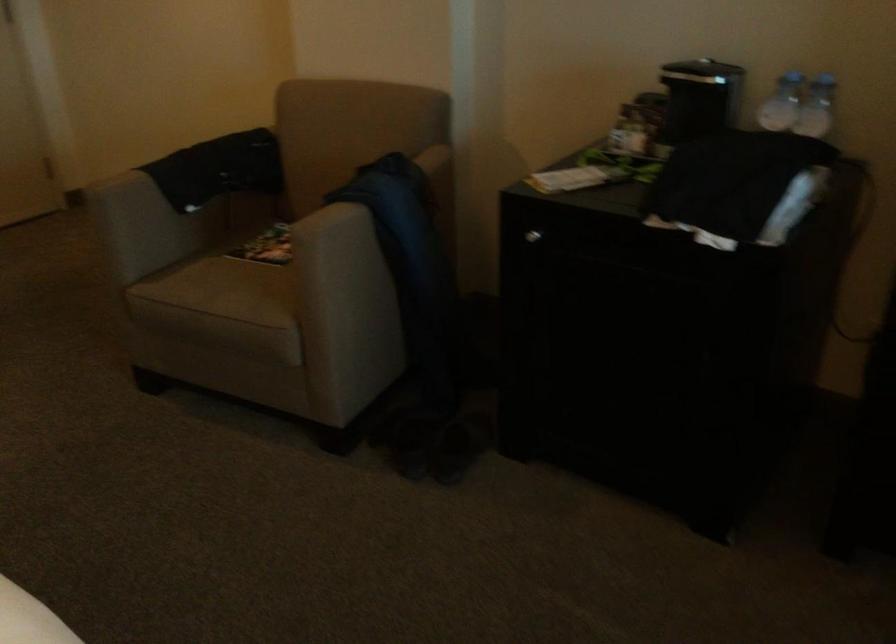
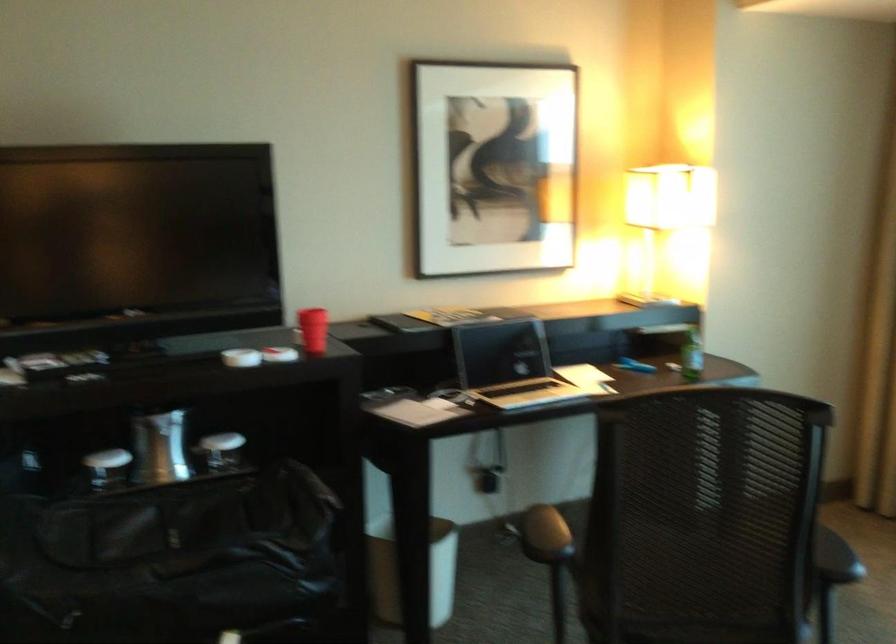
Question: The images are taken continuously from a first-person perspective. In which direction is your viewpoint rotating?

Choices:
 (A) Left
 (B) Right
 (C) Up
 (D) Down

Answer: (B)